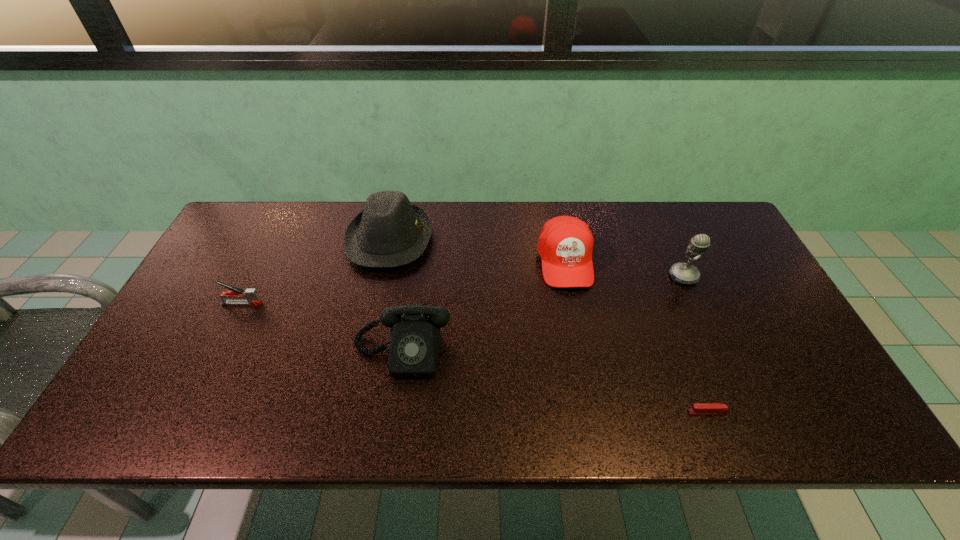
This screenshot has height=540, width=960. I want to click on microphone, so click(x=683, y=273).

Locate an element on the screen. fedora is located at coordinates pos(390,231).

This screenshot has height=540, width=960. In order to click on the fourth object from left to right in this screenshot , I will do `click(565, 244)`.

At what (x,y) coordinates should I click in order to perform the action: click on the fifth farthest object. Please return your answer as a coordinate pair (x, y). Looking at the image, I should click on (414, 344).

What are the coordinates of `the left stapler` in the screenshot? It's located at (251, 295).

What are the coordinates of `the fourth farthest object` in the screenshot? It's located at (251, 295).

This screenshot has width=960, height=540. In order to click on the nearer stapler in this screenshot , I will do `click(705, 408)`.

The height and width of the screenshot is (540, 960). In order to click on the shortest object in this screenshot , I will do `click(705, 408)`.

Locate an element on the screen. This screenshot has width=960, height=540. vacant space positioned 0.340m on the front-facing side of the tallest object is located at coordinates (736, 396).

The image size is (960, 540). What are the coordinates of `vacant space situated 0.240m on the front-facing side of the fedora` in the screenshot? It's located at (509, 239).